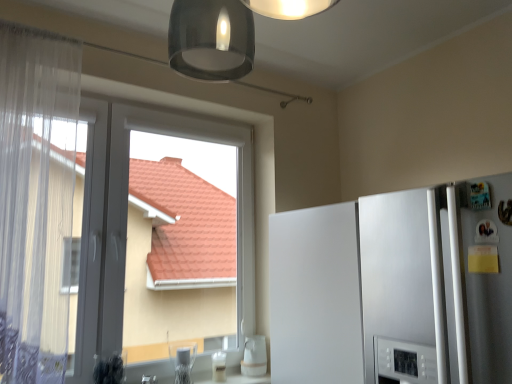
Question: Considering the relative positions of clear glass at lower center, acting as the 1th appliance starting from the right, and white glossy refrigerator at right in the image provided, is clear glass at lower center, acting as the 1th appliance starting from the right, behind white glossy refrigerator at right?

Choices:
 (A) no
 (B) yes

Answer: (B)

Question: Is clear glass at lower center, which is counted as the 2th appliance, starting from the left, thinner than white glossy refrigerator at right?

Choices:
 (A) no
 (B) yes

Answer: (B)

Question: Is clear glass at lower center, which is counted as the 2th appliance, starting from the left, smaller than white glossy refrigerator at right?

Choices:
 (A) no
 (B) yes

Answer: (B)

Question: Is clear glass at lower center, which is counted as the 2th appliance, starting from the left, to the right of white glossy refrigerator at right from the viewer's perspective?

Choices:
 (A) yes
 (B) no

Answer: (B)

Question: From a real-world perspective, is clear glass at lower center, acting as the 1th appliance starting from the right, on white glossy refrigerator at right?

Choices:
 (A) yes
 (B) no

Answer: (B)

Question: From a real-world perspective, is clear glass at lower center, acting as the 1th appliance starting from the right, under white glossy refrigerator at right?

Choices:
 (A) no
 (B) yes

Answer: (B)

Question: From a real-world perspective, is clear glass at lower center, which is counted as the 2th appliance, starting from the left, physically below white sheer curtain at left?

Choices:
 (A) no
 (B) yes

Answer: (B)

Question: From a real-world perspective, is clear glass at lower center, which is counted as the 2th appliance, starting from the left, positioned over white sheer curtain at left based on gravity?

Choices:
 (A) no
 (B) yes

Answer: (A)

Question: From the image's perspective, is clear glass at lower center, which is counted as the 2th appliance, starting from the left, below white sheer curtain at left?

Choices:
 (A) no
 (B) yes

Answer: (B)

Question: Is clear glass at lower center, which is counted as the 2th appliance, starting from the left, taller than white sheer curtain at left?

Choices:
 (A) yes
 (B) no

Answer: (B)

Question: Does clear glass at lower center, acting as the 1th appliance starting from the right, have a lesser width compared to white sheer curtain at left?

Choices:
 (A) yes
 (B) no

Answer: (A)

Question: Is clear glass at lower center, acting as the 1th appliance starting from the right, positioned beyond the bounds of white sheer curtain at left?

Choices:
 (A) yes
 (B) no

Answer: (A)

Question: Is transparent plastic window at left facing towards white glossy cup at lower center, arranged as the first appliance when viewed from the left?

Choices:
 (A) yes
 (B) no

Answer: (A)